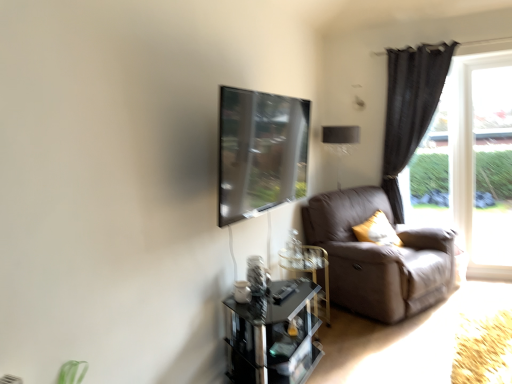
Question: Can you confirm if leather at right is taller than transparent glass window screen at upper center?

Choices:
 (A) no
 (B) yes

Answer: (B)

Question: Is leather at right outside transparent glass window screen at upper center?

Choices:
 (A) no
 (B) yes

Answer: (B)

Question: From a real-world perspective, is leather at right below transparent glass window screen at upper center?

Choices:
 (A) no
 (B) yes

Answer: (B)

Question: From the image's perspective, does leather at right appear lower than transparent glass window screen at upper center?

Choices:
 (A) no
 (B) yes

Answer: (B)

Question: Considering the relative positions of leather at right and transparent glass window screen at upper center in the image provided, is leather at right to the right of transparent glass window screen at upper center from the viewer's perspective?

Choices:
 (A) yes
 (B) no

Answer: (A)

Question: Is leather at right to the left of transparent glass window screen at upper center from the viewer's perspective?

Choices:
 (A) yes
 (B) no

Answer: (B)

Question: Is leather at right aimed at transparent glass window at right?

Choices:
 (A) yes
 (B) no

Answer: (B)

Question: Is leather at right positioned before transparent glass window at right?

Choices:
 (A) no
 (B) yes

Answer: (B)

Question: Is leather at right at the left side of transparent glass window at right?

Choices:
 (A) no
 (B) yes

Answer: (B)

Question: Does leather at right have a lesser height compared to transparent glass window at right?

Choices:
 (A) yes
 (B) no

Answer: (A)

Question: Is leather at right wider than transparent glass window at right?

Choices:
 (A) yes
 (B) no

Answer: (A)

Question: Is leather at right outside transparent glass window at right?

Choices:
 (A) no
 (B) yes

Answer: (B)

Question: Is transparent glass table at lower center at the left side of transparent glass window screen at upper center?

Choices:
 (A) yes
 (B) no

Answer: (B)